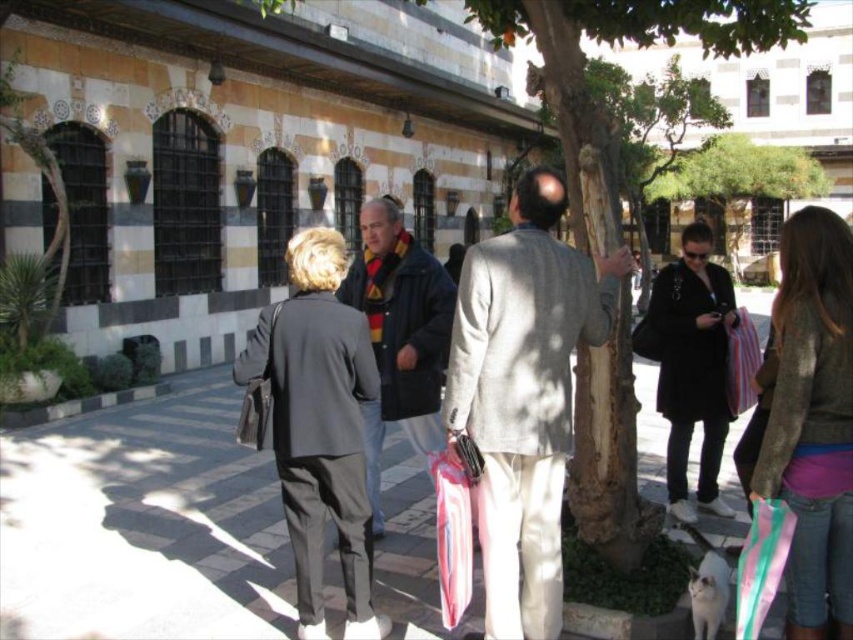
Question: Where is knitted sweater at center located in relation to striped fabric bag at center in the image?

Choices:
 (A) left
 (B) right

Answer: (B)

Question: Does knitted sweater at center have a lesser width compared to striped fabric bag at center?

Choices:
 (A) no
 (B) yes

Answer: (A)

Question: Which object appears closest to the camera in this image?

Choices:
 (A) dark blue jacket at center
 (B) striped fabric bag at lower right
 (C) knitted sweater at center
 (D) green leafy tree at upper center

Answer: (B)

Question: Which object is the farthest from the knitted sweater at center?

Choices:
 (A) green leafy tree at upper center
 (B) smooth bark tree at center
 (C) dark blue jacket at center

Answer: (A)

Question: Which is farther from the striped fabric bag at lower right?

Choices:
 (A) light gray fabric jacket at center
 (B) smooth bark tree at center
 (C) black matte coat at center
 (D) dark gray suit at center

Answer: (D)

Question: Can you confirm if light gray fabric jacket at center is bigger than striped fabric bag at lower right?

Choices:
 (A) yes
 (B) no

Answer: (A)